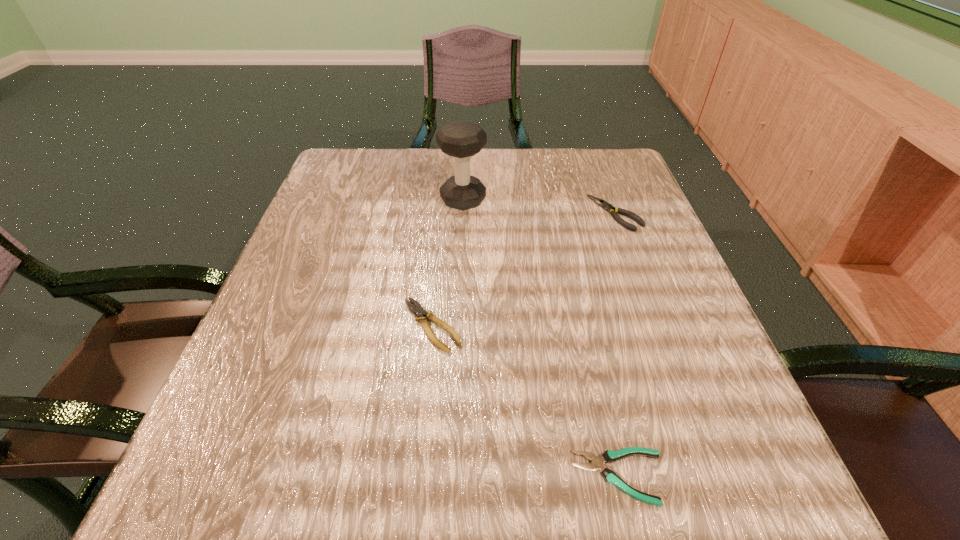
Identify the location of unoccupied position between the dumbbell and the shortest pliers. (541, 339).

Identify the location of vacant area that lies between the tallest object and the rightmost pliers. The image size is (960, 540). (540, 206).

Find the location of `object that stands as the closest to the third farthest object`. object that stands as the closest to the third farthest object is located at coordinates (597, 463).

Find the location of a particular element. This screenshot has width=960, height=540. the second closest object to the second tallest object is located at coordinates (419, 311).

This screenshot has height=540, width=960. Identify the location of pliers that is the nearest to the dumbbell. (605, 205).

The image size is (960, 540). I want to click on the second closest pliers to the second shortest object, so click(x=605, y=205).

Locate an element on the screen. vacant region that satisfies the following two spatial constraints: 1. on the front side of the farthest pliers; 2. on the right side of the dumbbell is located at coordinates (463, 213).

You are a GUI agent. You are given a task and a screenshot of the screen. Output one action in this format:
    pyautogui.click(x=<x>, y=<y>)
    Task: Click on the vacant region that satisfies the following two spatial constraints: 1. on the front side of the third object from left to right; 2. on the right side of the second tallest pliers
    The width and height of the screenshot is (960, 540).
    Given the screenshot: What is the action you would take?
    418,477

Locate an element on the screen. The width and height of the screenshot is (960, 540). free space that satisfies the following two spatial constraints: 1. on the front side of the second nearest object; 2. on the left side of the second object from right to left is located at coordinates (418, 477).